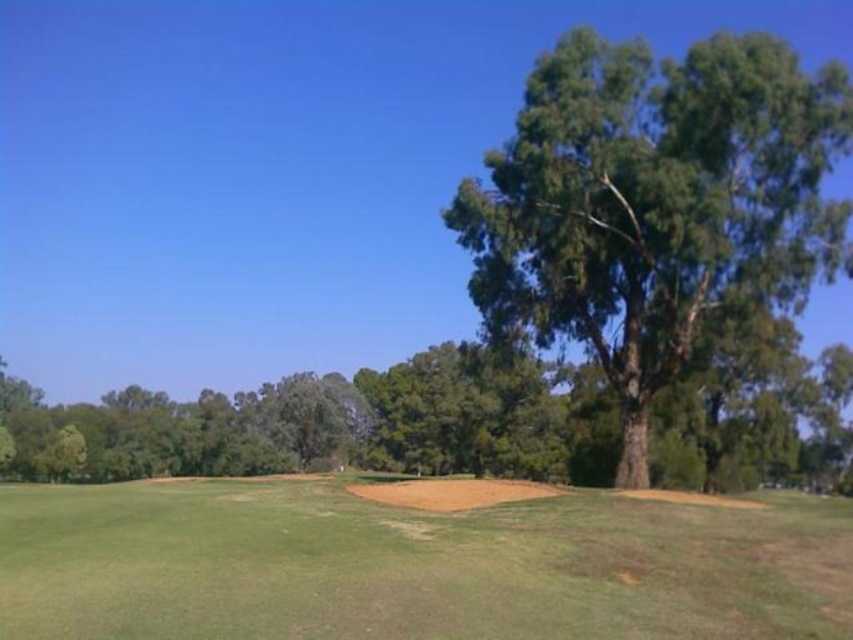
In the scene shown: You are standing at the center of the golf course and see two points marked in the scene. Which point, point (585, 621) or point (728, 113), is closer to you?

Point (585, 621) is closer to the viewer than point (728, 113).

You are standing on the green grassy field at center and want to walk to the green leafy tree at right. Which direction should you head towards?

The green leafy tree at right is located to your right side, so you should head towards the right direction to reach it.

You are a golfer standing on the tee, aiming to hit your ball into the fairway. You notice the green grassy field at center and the green leafy tree at right. Which area is more likely to provide a clear path for your ball to land without obstruction?

The green grassy field at center is wider than the green leafy tree at right, so it offers a larger open area for the ball to land without hitting the tree.